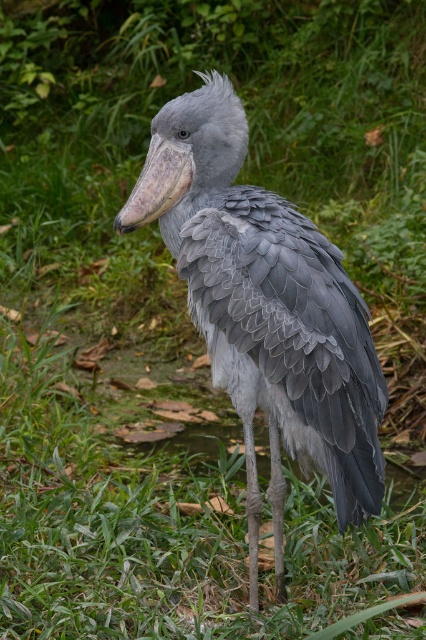
Which is behind, point (187, 202) or point (140, 214)?

The point (187, 202) is more distant.

The image size is (426, 640). What are the coordinates of `gray feathered bird at center` in the screenshot? It's located at (264, 308).

Who is more distant from viewer, (276, 333) or (161, 177)?

The point (161, 177) is behind.

The width and height of the screenshot is (426, 640). Identify the location of gray feathered bird at center. (264, 308).